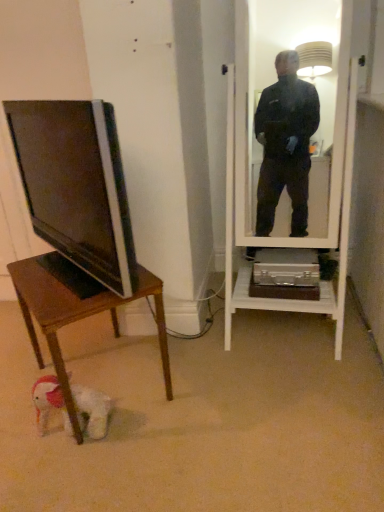
Question: From the image's perspective, is matte black tv at left positioned above or below wooden desk at lower left?

Choices:
 (A) above
 (B) below

Answer: (A)

Question: Is matte black tv at left taller or shorter than wooden desk at lower left?

Choices:
 (A) tall
 (B) short

Answer: (A)

Question: Estimate the real-world distances between objects in this image. Which object is closer to the wooden desk at lower left?

Choices:
 (A) matte black tv at left
 (B) white plush dog at lower left

Answer: (B)

Question: Which object is positioned closest to the matte black tv at left?

Choices:
 (A) white plush dog at lower left
 (B) wooden desk at lower left

Answer: (B)